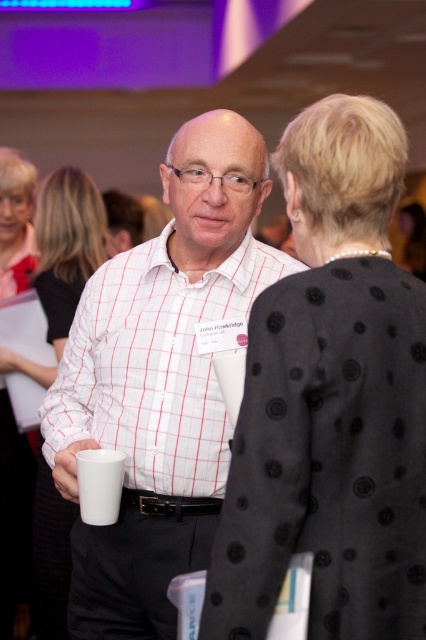
You are attending a conference and notice a person wearing a white checkered shirt at center. Where exactly is this person positioned in the image?

The white checkered shirt at center is located at point 0.570 on the x axis and 0.364 on the y axis.

You are at a conference and see two items in front of you. One is a white checkered shirt at center and the other is a matte white mug at center. Which item is positioned to the right of the other?

The white checkered shirt at center is positioned to the right of the matte white mug at center.

You are at a conference and need to place your matte white mug at center on the table without it touching the black dotted jacket at center. Is the space between them sufficient?

The black dotted jacket at center has a lesser width compared to matte white mug at center, so the space between them might not be sufficient to place the mug without touching the jacket.